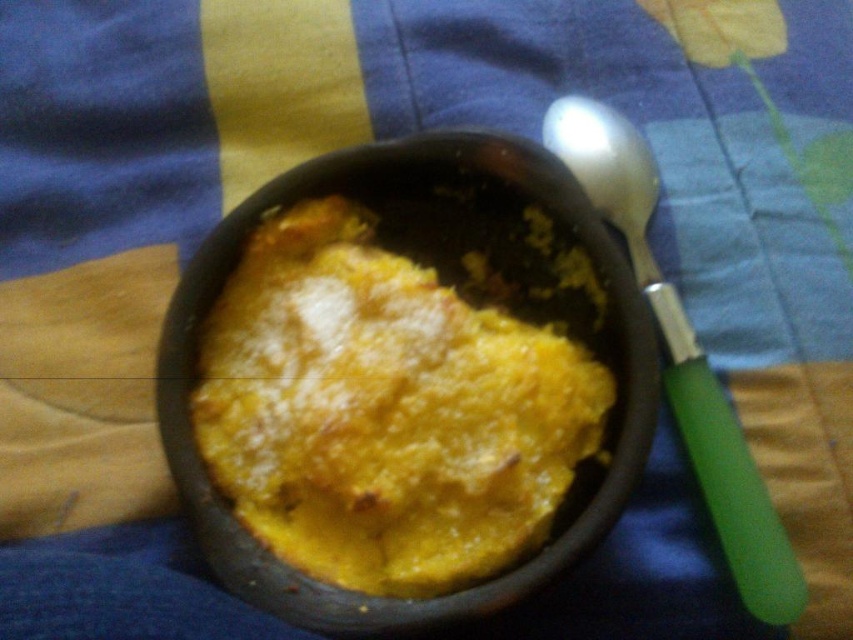
You are a photographer standing at a certain distance from the yellow matte cake at center. You want to take a close up shot of it. Do you need to move closer or farther away?

The yellow matte cake at center is 3.64 feet away from the camera, so to take a close up shot, you need to move closer to the cake.

You are a chef preparing to place a decorative garnish on the yellow matte cake at center. The garnish must be placed precisely at the coordinates point (x=387, y=408). Can you confirm the exact location of the yellow matte cake at center to ensure the garnish is placed correctly?

The yellow matte cake at center is located at point (x=387, y=408), so placing the garnish there will be accurate.

What is the exact coordinate of the yellow matte cake at center?

The yellow matte cake at center is located at point (387, 408).